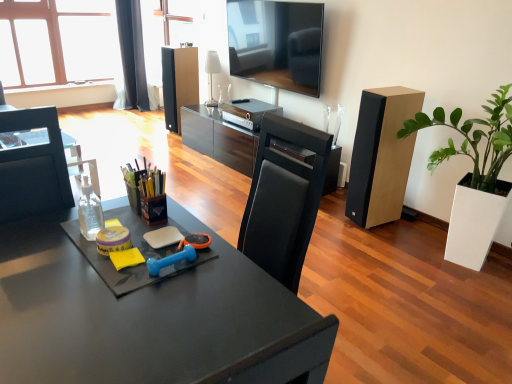
What is the approximate width of clear glass window at upper left?

The width of clear glass window at upper left is 9.36 inches.

What do you see at coordinates (381, 155) in the screenshot?
I see `light brown wood speaker at right, placed as the first speaker when sorted from front to back` at bounding box center [381, 155].

What is the approximate width of yellow sponge at center?

The width of yellow sponge at center is 4.50 inches.

In order to click on matte black desk at center in this screenshot , I will do `click(149, 319)`.

Where is `black fabric curtain at upper left`? This screenshot has width=512, height=384. black fabric curtain at upper left is located at coordinates (132, 54).

Is matte black desk at center far from matte black speaker at center, placed as the second speaker when sorted from front to back?

Yes, matte black desk at center is far from matte black speaker at center, placed as the second speaker when sorted from front to back.

Is point (233, 382) in front of point (193, 69)?

Yes, it is in front of point (193, 69).

Considering the relative sizes of matte black desk at center and matte black speaker at center, the first speaker when ordered from back to front, in the image provided, is matte black desk at center shorter than matte black speaker at center, the first speaker when ordered from back to front,?

Yes.

Are clear plastic bottle at left and yellow sponge at center making contact?

clear plastic bottle at left and yellow sponge at center are not in contact.

Which object is closer to the camera, clear plastic bottle at left or yellow sponge at center?

Positioned in front is yellow sponge at center.

How many degrees apart are the facing directions of clear plastic bottle at left and yellow sponge at center?

clear plastic bottle at left and yellow sponge at center are facing 0.00311 degrees away from each other.

Considering the relative sizes of clear plastic bottle at left and yellow sponge at center in the image provided, is clear plastic bottle at left thinner than yellow sponge at center?

Correct, the width of clear plastic bottle at left is less than that of yellow sponge at center.

At what (x,y) coordinates should I click in order to perform the action: click on window that is on the left side of matte black speaker at center, the first speaker in the top-to-bottom sequence. Please return your answer as a coordinate pair (x, y). This screenshot has height=384, width=512. Looking at the image, I should click on pyautogui.click(x=58, y=42).

From a real-world perspective, is clear glass window at upper left below matte black speaker at center, the first speaker in the top-to-bottom sequence?

No, from a real-world perspective, clear glass window at upper left is not below matte black speaker at center, the first speaker in the top-to-bottom sequence.

Is clear glass window at upper left thinner than matte black speaker at center, acting as the first speaker starting from the left?

Indeed, clear glass window at upper left has a lesser width compared to matte black speaker at center, acting as the first speaker starting from the left.

Is the depth of clear glass window at upper left less than that of matte black speaker at center, the 2th speaker viewed from the right?

No, it is not.

Which object is positioned more to the right, black fabric curtain at upper left or green matte plant at right?

green matte plant at right is more to the right.

Are black fabric curtain at upper left and green matte plant at right beside each other?

No, black fabric curtain at upper left is not touching green matte plant at right.

Considering the positions of objects black fabric curtain at upper left and green matte plant at right in the image provided, who is behind, black fabric curtain at upper left or green matte plant at right?

black fabric curtain at upper left.

Which of these two, black fabric curtain at upper left or green matte plant at right, stands shorter?

green matte plant at right.

Which is more to the left, light brown wood speaker at right, which ranks as the 2th speaker in left-to-right order, or green matte plant at right?

light brown wood speaker at right, which ranks as the 2th speaker in left-to-right order, is more to the left.

From the picture: Which object is thinner, light brown wood speaker at right, the first speaker from the bottom, or green matte plant at right?

Thinner between the two is light brown wood speaker at right, the first speaker from the bottom.

How many degrees apart are the facing directions of light brown wood speaker at right, which ranks as the 2th speaker in left-to-right order, and green matte plant at right?

11.3 degrees.

Considering the sizes of objects light brown wood speaker at right, which ranks as the 2th speaker in left-to-right order, and clear glass window at upper left in the image provided, who is shorter, light brown wood speaker at right, which ranks as the 2th speaker in left-to-right order, or clear glass window at upper left?

With less height is light brown wood speaker at right, which ranks as the 2th speaker in left-to-right order.

From a real-world perspective, is light brown wood speaker at right, acting as the second speaker starting from the back, on top of clear glass window at upper left?

No, from a real-world perspective, light brown wood speaker at right, acting as the second speaker starting from the back, is not on top of clear glass window at upper left.

Does light brown wood speaker at right, arranged as the first speaker when viewed from the right, appear on the right side of clear glass window at upper left?

Correct, you'll find light brown wood speaker at right, arranged as the first speaker when viewed from the right, to the right of clear glass window at upper left.

From a real-world perspective, which is physically below, matte black speaker at center, placed as the second speaker when sorted from front to back, or green matte plant at right?

matte black speaker at center, placed as the second speaker when sorted from front to back, is physically lower.

This screenshot has width=512, height=384. In order to click on houseplant on the right side of matte black speaker at center, which is the 2th speaker from bottom to top in this screenshot , I will do `click(473, 175)`.

Which object is positioned more to the right, matte black speaker at center, the first speaker in the top-to-bottom sequence, or green matte plant at right?

Positioned to the right is green matte plant at right.

The image size is (512, 384). I want to click on speaker to the left of matte black desk at center, so [x=179, y=83].

This screenshot has height=384, width=512. What are the coordinates of `stationery in front of the clear plastic bottle at left` in the screenshot? It's located at (113, 240).

Estimate the real-world distances between objects in this image. Which object is closer to clear glass window at upper left, black fabric curtain at upper left or green matte plant at right?

black fabric curtain at upper left is closer to clear glass window at upper left.

Which object lies further to the anchor point matte black speaker at center, placed as the second speaker when sorted from front to back, white glossy lamp at upper center or matte black desk at center?

matte black desk at center is further to matte black speaker at center, placed as the second speaker when sorted from front to back.

Estimate the real-world distances between objects in this image. Which object is closer to black fabric curtain at upper left, matte black speaker at center, acting as the first speaker starting from the left, or clear plastic bottle at left?

matte black speaker at center, acting as the first speaker starting from the left, is positioned closer to the anchor black fabric curtain at upper left.

Which object lies further to the anchor point light brown wood speaker at right, which ranks as the 2th speaker in top-to-bottom order, yellow sponge at center or matte black speaker at center, the first speaker in the top-to-bottom sequence?

matte black speaker at center, the first speaker in the top-to-bottom sequence.

Based on their spatial positions, is green matte plant at right or matte black desk at center further from yellow sponge at center?

green matte plant at right lies further to yellow sponge at center than the other object.

Which object lies nearer to the anchor point white glossy lamp at upper center, matte black speaker at center, placed as the second speaker when sorted from front to back, or clear plastic bottle at left?

matte black speaker at center, placed as the second speaker when sorted from front to back, is positioned closer to the anchor white glossy lamp at upper center.

Based on their spatial positions, is clear plastic bottle at left or black fabric curtain at upper left closer to matte black speaker at center, which is the 2th speaker from bottom to top?

black fabric curtain at upper left is positioned closer to the anchor matte black speaker at center, which is the 2th speaker from bottom to top.

Based on their spatial positions, is matte black desk at center or clear plastic bottle at left further from green matte plant at right?

The object further to green matte plant at right is clear plastic bottle at left.

Identify the location of houseplant between matte black desk at center and white glossy lamp at upper center from front to back. (473, 175).

You are a GUI agent. You are given a task and a screenshot of the screen. Output one action in this format:
    pyautogui.click(x=<x>, y=<y>)
    Task: Click on the bottle between matte black desk at center and white glossy lamp at upper center from front to back
    Image resolution: width=512 pixels, height=384 pixels.
    Given the screenshot: What is the action you would take?
    pyautogui.click(x=90, y=211)

At what (x,y) coordinates should I click in order to perform the action: click on lamp between yellow sponge at center and black fabric curtain at upper left along the z-axis. Please return your answer as a coordinate pair (x, y). Looking at the image, I should click on coord(212,73).

Locate an element on the screen. speaker between clear plastic bottle at left and white glossy lamp at upper center in the front-back direction is located at coordinates (381, 155).